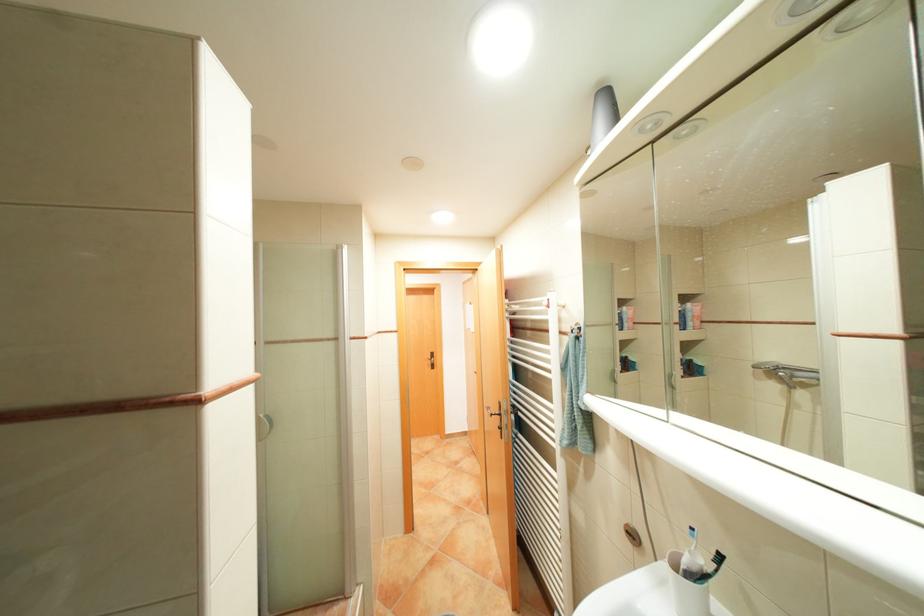
Find the location of a particular element. The width and height of the screenshot is (924, 616). shower faucet handle is located at coordinates (787, 373).